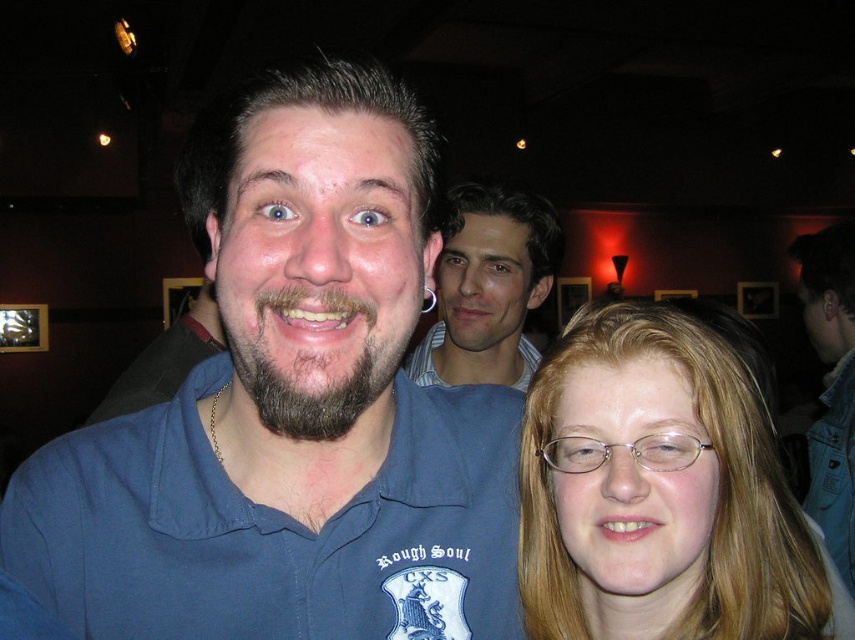
Question: Which point is closer to the camera taking this photo?

Choices:
 (A) (102, 464)
 (B) (463, 195)
 (C) (842, 422)

Answer: (A)

Question: Which point is closer to the camera taking this photo?

Choices:
 (A) (203, 467)
 (B) (846, 328)
 (C) (691, 492)
 (D) (519, 352)

Answer: (C)

Question: Which point is closer to the camera taking this photo?

Choices:
 (A) (27, 557)
 (B) (463, 321)
 (C) (732, 550)
 (D) (847, 483)

Answer: (C)

Question: Can you confirm if blue cotton shirt at center is wider than smooth skin face at center?

Choices:
 (A) yes
 (B) no

Answer: (A)

Question: Where is smooth skin face at center located in relation to denim jacket at lower right in the image?

Choices:
 (A) right
 (B) left

Answer: (B)

Question: Does blue cotton shirt at center have a greater width compared to denim jacket at lower right?

Choices:
 (A) yes
 (B) no

Answer: (A)